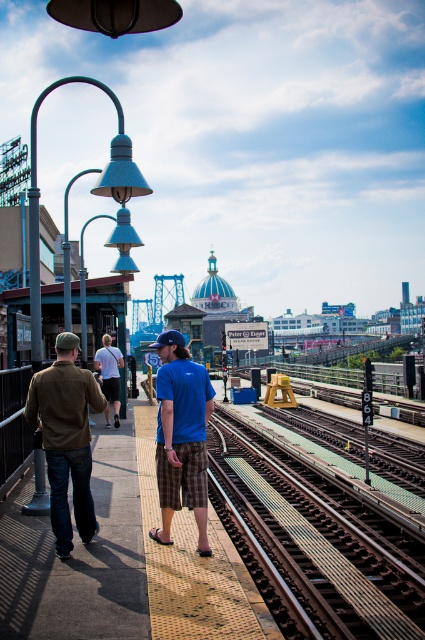
Who is shorter, brown metal train track at center or blue cotton shirt at center?

Standing shorter between the two is brown metal train track at center.

You are a GUI agent. You are given a task and a screenshot of the screen. Output one action in this format:
    pyautogui.click(x=<x>, y=<y>)
    Task: Click on the brown metal train track at center
    
    Given the screenshot: What is the action you would take?
    pyautogui.click(x=320, y=536)

Who is more distant from viewer, (278, 556) or (198, 529)?

The point (278, 556) is behind.

Find the location of a particular element. The height and width of the screenshot is (640, 425). brown metal train track at center is located at coordinates (320, 536).

Is brown metal train track at center further to the viewer compared to white cotton shirt at center?

That is False.

The height and width of the screenshot is (640, 425). What are the coordinates of `brown metal train track at center` in the screenshot? It's located at (320, 536).

The image size is (425, 640). In order to click on brown metal train track at center in this screenshot , I will do `click(320, 536)`.

Does matte brown jacket at left have a greater width compared to white cotton shirt at center?

In fact, matte brown jacket at left might be narrower than white cotton shirt at center.

Find the location of `matte brown jacket at left`. matte brown jacket at left is located at coordinates (67, 438).